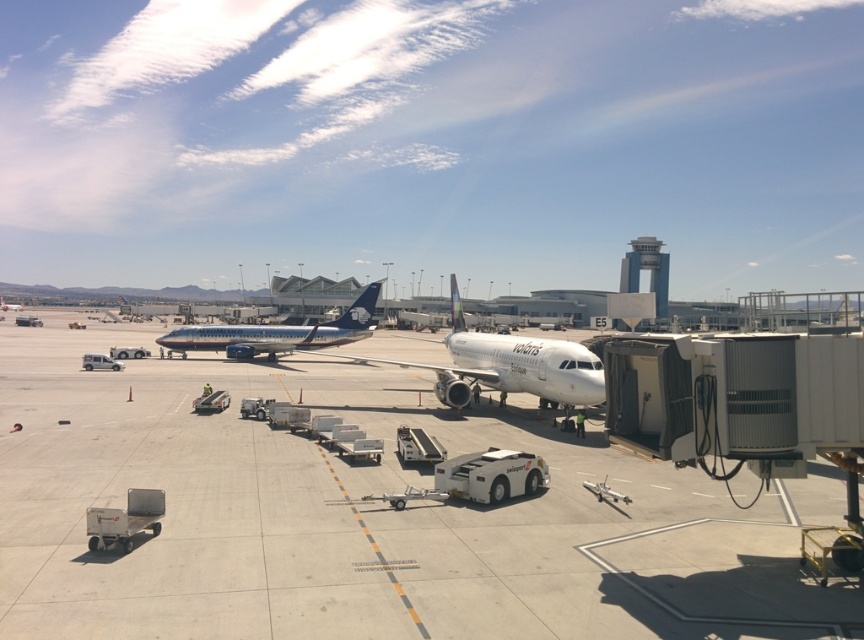
How distant is white smooth tarmac at center from blue metallic airplane at center?

The distance of white smooth tarmac at center from blue metallic airplane at center is 10.30 meters.

Does white smooth tarmac at center have a smaller size compared to blue metallic airplane at center?

Actually, white smooth tarmac at center might be larger than blue metallic airplane at center.

Is point (577, 632) farther from camera compared to point (257, 353)?

No, (577, 632) is closer to viewer.

Identify the location of white smooth tarmac at center. (367, 516).

Can you confirm if white smooth tarmac at center is taller than white glossy airplane at center?

No.

Can you confirm if white smooth tarmac at center is positioned below white glossy airplane at center?

Yes.

Which is behind, point (618, 566) or point (477, 369)?

Point (477, 369)

You are a GUI agent. You are given a task and a screenshot of the screen. Output one action in this format:
    pyautogui.click(x=<x>, y=<y>)
    Task: Click on the white smooth tarmac at center
    
    Given the screenshot: What is the action you would take?
    pyautogui.click(x=367, y=516)

Which is more to the left, white glossy airplane at center or blue metallic airplane at center?

blue metallic airplane at center is more to the left.

Which of these two, white glossy airplane at center or blue metallic airplane at center, stands shorter?

white glossy airplane at center is shorter.

I want to click on white glossy airplane at center, so click(x=510, y=365).

Find the location of a particular element. white glossy airplane at center is located at coordinates (510, 365).